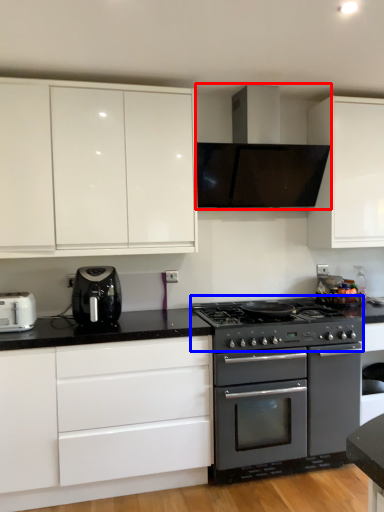
Question: Which object is closer to the camera taking this photo, home appliance (highlighted by a red box) or gas stove (highlighted by a blue box)?

Choices:
 (A) home appliance
 (B) gas stove

Answer: (B)